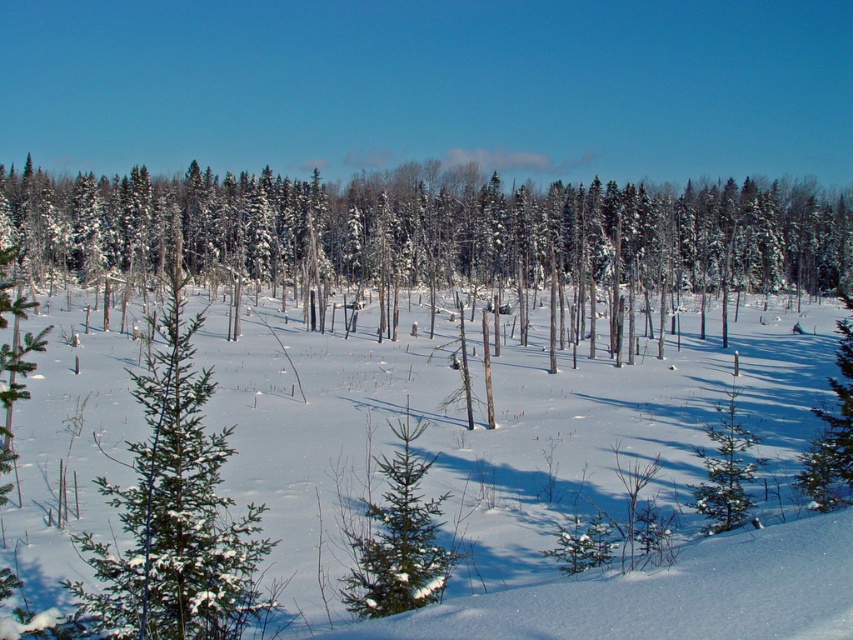
Who is lower down, white fluffy snow at center or green textured pine at center?

green textured pine at center is below.

Does point (302, 493) lie behind point (383, 465)?

That is True.

Is point (442, 634) positioned before point (450, 557)?

Yes, point (442, 634) is in front of point (450, 557).

Where is `white fluffy snow at center`? white fluffy snow at center is located at coordinates (283, 429).